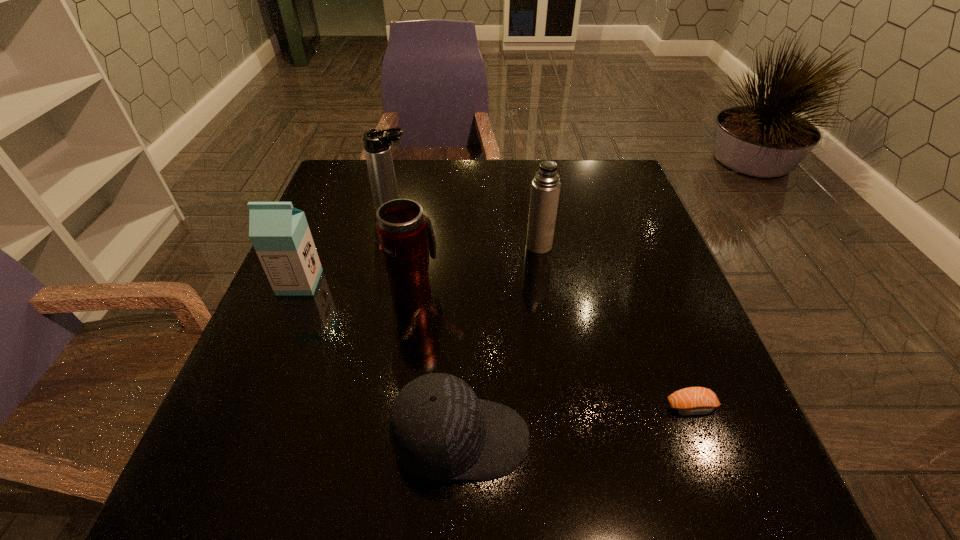
You are a GUI agent. You are given a task and a screenshot of the screen. Output one action in this format:
    pyautogui.click(x=<x>, y=<y>)
    Task: Click on the object located in the right edge section of the desktop
    The image size is (960, 540).
    Given the screenshot: What is the action you would take?
    pyautogui.click(x=689, y=401)

Find the location of a particular element. Image resolution: width=960 pixels, height=540 pixels. object that is at the far left corner is located at coordinates pos(377,148).

Image resolution: width=960 pixels, height=540 pixels. I want to click on vacant area at the far edge, so click(434, 183).

The width and height of the screenshot is (960, 540). What are the coordinates of `free space at the left edge of the desktop` in the screenshot? It's located at (271, 311).

You are a GUI agent. You are given a task and a screenshot of the screen. Output one action in this format:
    pyautogui.click(x=<x>, y=<y>)
    Task: Click on the vacant space at the right edge of the desktop
    
    Given the screenshot: What is the action you would take?
    pyautogui.click(x=624, y=227)

I want to click on vacant space at the far left corner of the desktop, so click(x=318, y=201).

Locate an element on the screen. The height and width of the screenshot is (540, 960). vacant region at the far right corner of the desktop is located at coordinates (583, 202).

This screenshot has width=960, height=540. I want to click on blank region between the farthest object and the sushi, so click(542, 308).

This screenshot has height=540, width=960. I want to click on vacant point located between the nearest thermos bottle and the sushi, so click(553, 350).

What are the coordinates of `vacant area that lies between the nearest thermos bottle and the fifth tallest object` in the screenshot? It's located at (438, 366).